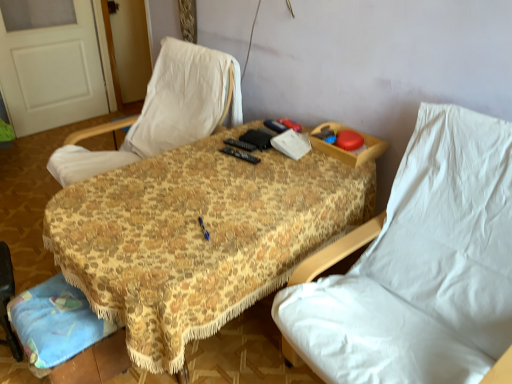
Question: Does floral fabric table at center have a greater height compared to white matte door at upper left?

Choices:
 (A) no
 (B) yes

Answer: (A)

Question: Is floral fabric table at center not inside white matte door at upper left?

Choices:
 (A) yes
 (B) no

Answer: (A)

Question: Considering the relative sizes of floral fabric table at center and white matte door at upper left in the image provided, is floral fabric table at center shorter than white matte door at upper left?

Choices:
 (A) no
 (B) yes

Answer: (B)

Question: Can you confirm if floral fabric table at center is bigger than white matte door at upper left?

Choices:
 (A) yes
 (B) no

Answer: (A)

Question: From a real-world perspective, is floral fabric table at center under white matte door at upper left?

Choices:
 (A) no
 (B) yes

Answer: (B)

Question: From the image's perspective, is floral fabric table at center located above or below white fabric chair at center, which ranks as the 1th chair in left-to-right order?

Choices:
 (A) below
 (B) above

Answer: (A)

Question: Is floral fabric table at center situated inside white fabric chair at center, the 2th chair when ordered from right to left, or outside?

Choices:
 (A) inside
 (B) outside

Answer: (B)

Question: Considering the relative positions of floral fabric table at center and white fabric chair at center, the 2th chair when ordered from right to left, in the image provided, is floral fabric table at center to the left or to the right of white fabric chair at center, the 2th chair when ordered from right to left,?

Choices:
 (A) left
 (B) right

Answer: (B)

Question: Is point (332, 196) closer or farther from the camera than point (181, 74)?

Choices:
 (A) farther
 (B) closer

Answer: (B)

Question: Would you say white matte door at upper left is to the left or to the right of white fabric chair at right, positioned as the first chair in right-to-left order, in the picture?

Choices:
 (A) right
 (B) left

Answer: (B)

Question: Is white matte door at upper left inside the boundaries of white fabric chair at right, positioned as the first chair in right-to-left order, or outside?

Choices:
 (A) inside
 (B) outside

Answer: (B)

Question: In terms of height, does white matte door at upper left look taller or shorter compared to white fabric chair at right, the second chair viewed from the left?

Choices:
 (A) short
 (B) tall

Answer: (B)

Question: In terms of size, does white matte door at upper left appear bigger or smaller than white fabric chair at right, positioned as the first chair in right-to-left order?

Choices:
 (A) big
 (B) small

Answer: (B)

Question: From the image's perspective, relative to white fabric chair at right, the second chair viewed from the left, is white fabric chair at center, the 2th chair when ordered from right to left, above or below?

Choices:
 (A) below
 (B) above

Answer: (B)

Question: Would you say white fabric chair at center, which ranks as the 1th chair in left-to-right order, is to the left or to the right of white fabric chair at right, the second chair viewed from the left, in the picture?

Choices:
 (A) left
 (B) right

Answer: (A)